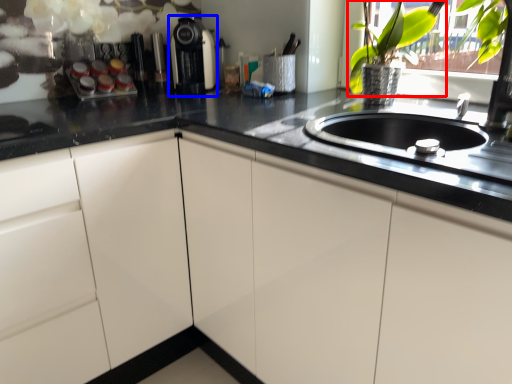
Question: Which of the following is the closest to the observer, floral arrangement (highlighted by a red box) or coffee machine (highlighted by a blue box)?

Choices:
 (A) floral arrangement
 (B) coffee machine

Answer: (A)